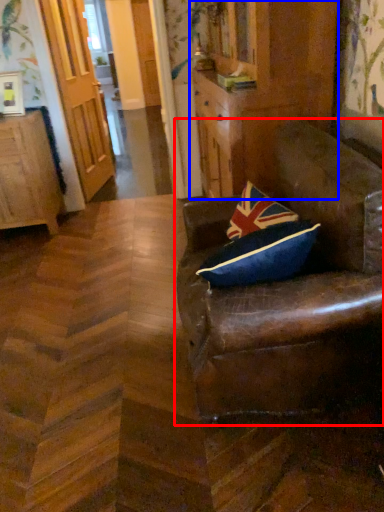
Question: Among these objects, which one is farthest to the camera, chair (highlighted by a red box) or dresser (highlighted by a blue box)?

Choices:
 (A) chair
 (B) dresser

Answer: (B)